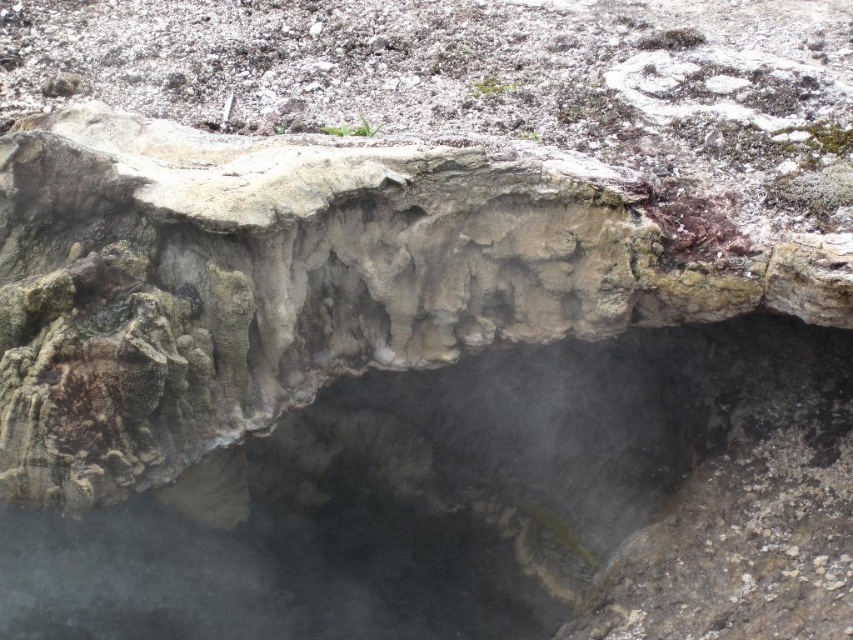
Question: Is smoke-like water at center above rough stone cave at center?

Choices:
 (A) no
 (B) yes

Answer: (A)

Question: Does smoke-like water at center lie behind rough stone cave at center?

Choices:
 (A) yes
 (B) no

Answer: (A)

Question: Which point is farther from the camera taking this photo?

Choices:
 (A) (79, 154)
 (B) (102, 518)

Answer: (B)

Question: Does smoke-like water at center have a smaller size compared to rough stone cave at center?

Choices:
 (A) yes
 (B) no

Answer: (B)

Question: Which of the following is the closest to the observer?

Choices:
 (A) (796, 333)
 (B) (80, 230)

Answer: (B)